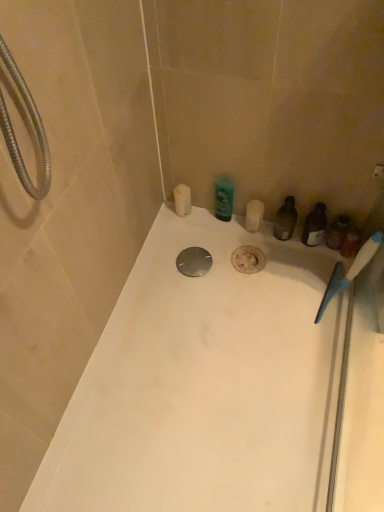
At what (x,y) coordinates should I click in order to perform the action: click on vacant area in front of blue plastic toothbrush at right. Please return your answer as a coordinate pair (x, y). This screenshot has width=384, height=512. Looking at the image, I should click on (323, 356).